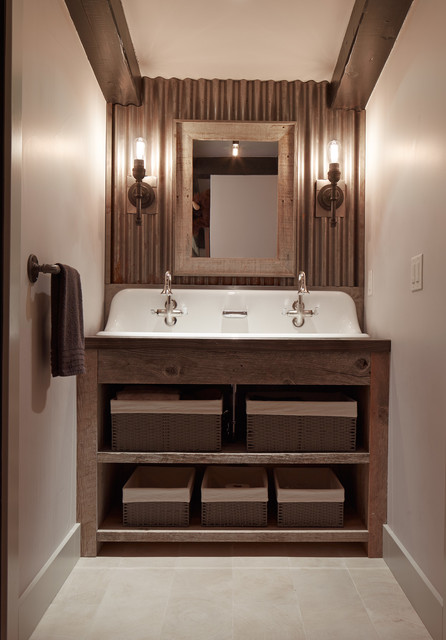
You are a GUI agent. You are given a task and a screenshot of the screen. Output one action in this format:
    pyautogui.click(x=<x>, y=<y>)
    Task: Click on the basket
    This screenshot has height=640, width=446.
    Given the screenshot: What is the action you would take?
    pyautogui.click(x=174, y=428), pyautogui.click(x=159, y=515), pyautogui.click(x=232, y=512), pyautogui.click(x=307, y=516), pyautogui.click(x=307, y=429)